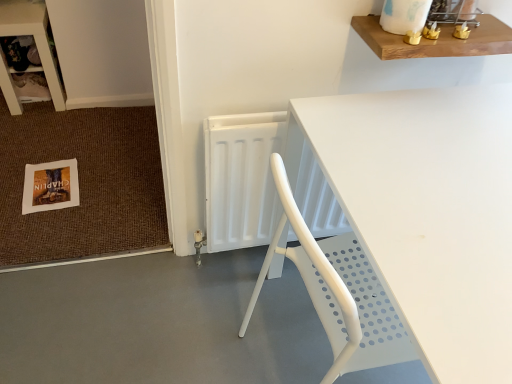
Identify the location of spots to the right of white paper postcard at lower left. This screenshot has width=512, height=384. (109, 190).